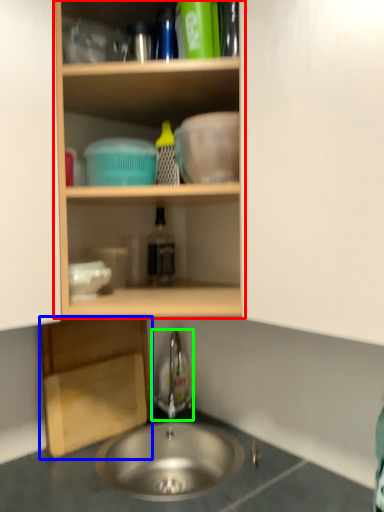
Question: Which object is positioned farthest from shelf (highlighted by a red box)? Select from cabinetry (highlighted by a blue box) and faucet (highlighted by a green box).

Choices:
 (A) cabinetry
 (B) faucet

Answer: (B)